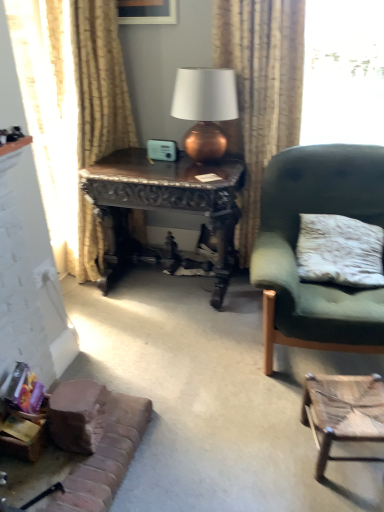
Identify the location of empty space that is ontop of brown fabric couch at lower left (from a real-world perspective). The image size is (384, 512). coord(67,453).